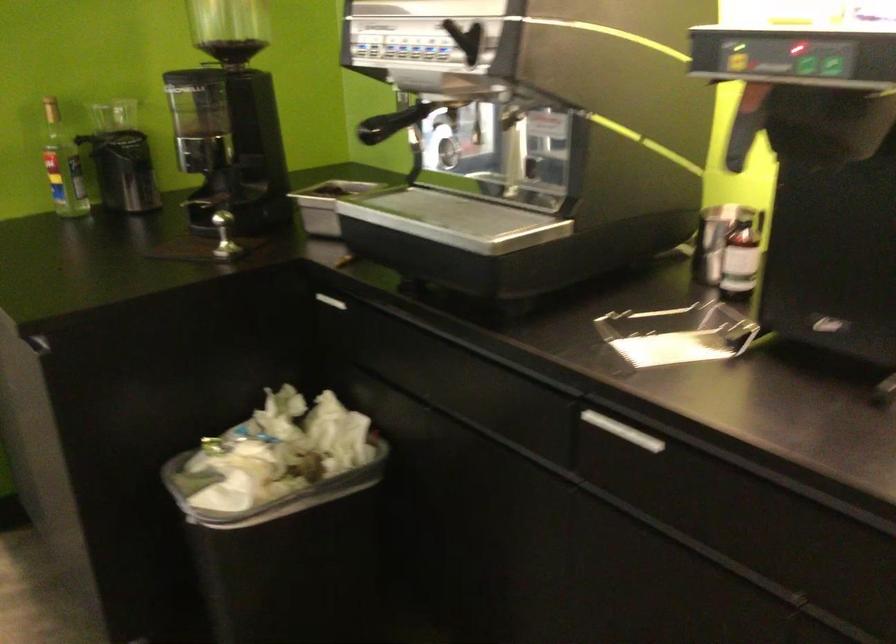
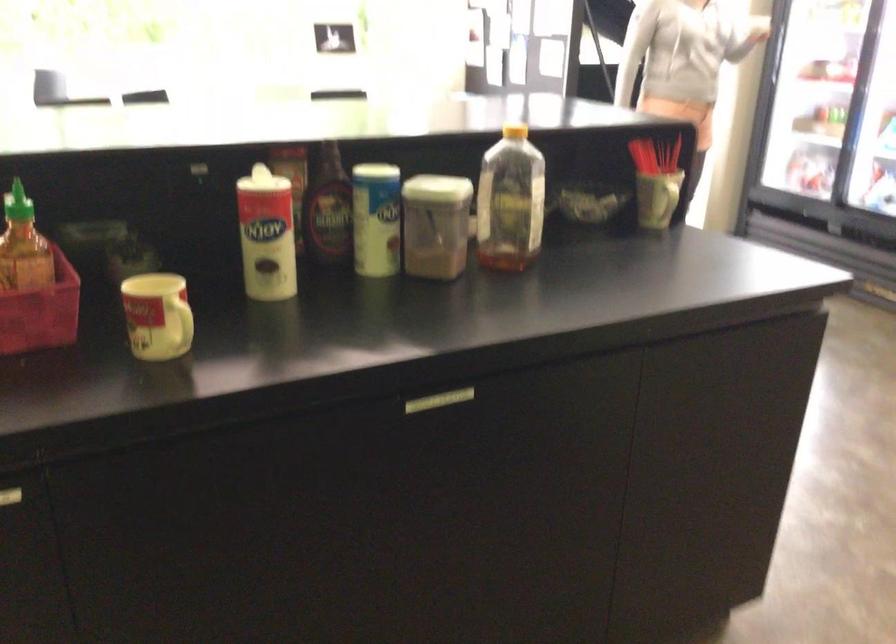
How did the camera likely rotate?

The rotation direction of the camera is left-down.